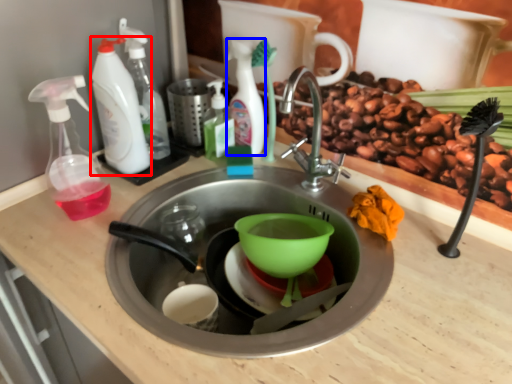
Question: Among these objects, which one is farthest to the camera, cleaning product (highlighted by a red box) or cleaning product (highlighted by a blue box)?

Choices:
 (A) cleaning product
 (B) cleaning product

Answer: (B)